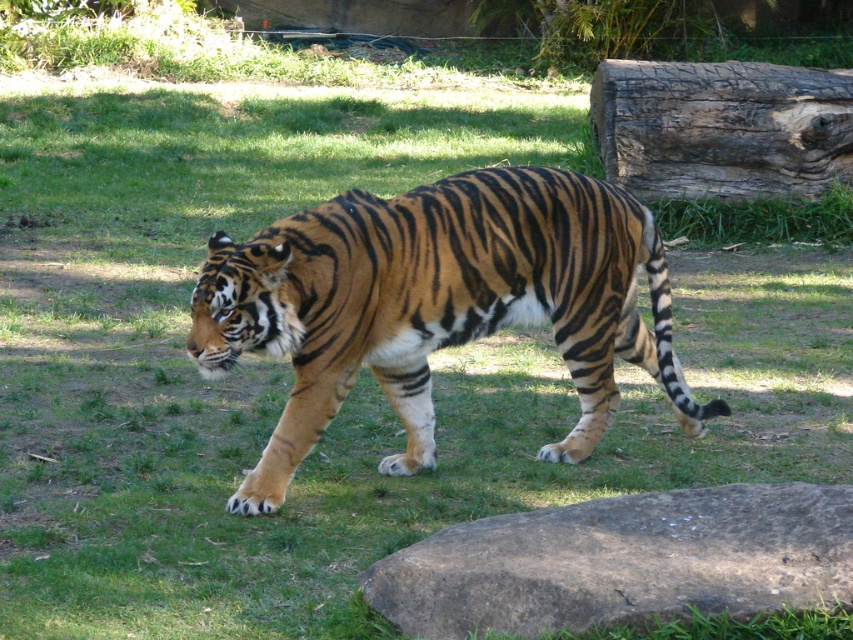
Question: Among these points, which one is nearest to the camera?

Choices:
 (A) (611, 333)
 (B) (630, 502)
 (C) (811, 83)

Answer: (B)

Question: Is brown rough rock at lower right wider than dark brown textured log at upper right?

Choices:
 (A) no
 (B) yes

Answer: (A)

Question: From the image, what is the correct spatial relationship of brown rough rock at lower right in relation to dark brown textured log at upper right?

Choices:
 (A) below
 (B) above

Answer: (A)

Question: Is orange-brown striped tiger at center in front of dark brown textured log at upper right?

Choices:
 (A) no
 (B) yes

Answer: (B)

Question: Which of the following is the farthest from the observer?

Choices:
 (A) brown rough rock at lower right
 (B) dark brown textured log at upper right
 (C) orange-brown striped tiger at center

Answer: (B)

Question: Which point is farther to the camera?

Choices:
 (A) orange-brown striped tiger at center
 (B) brown rough rock at lower right

Answer: (A)